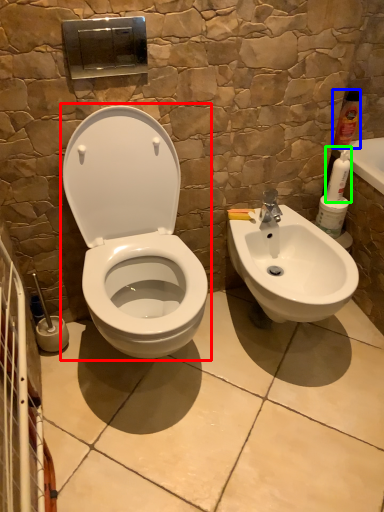
Question: Based on their relative distances, which object is farther from toilet (highlighted by a red box)? Choose from cleaning product (highlighted by a blue box) and cleaning product (highlighted by a green box).

Choices:
 (A) cleaning product
 (B) cleaning product

Answer: (A)